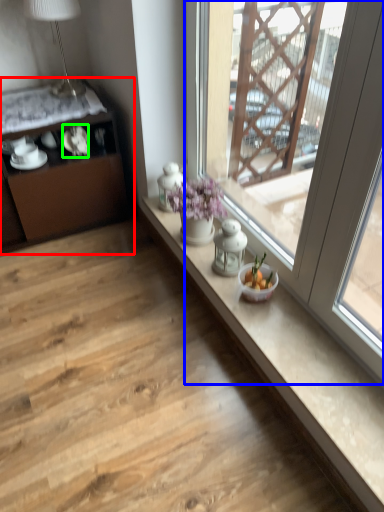
Question: Based on their relative distances, which object is nearer to cabinetry (highlighted by a red box)? Choose from window (highlighted by a blue box) and tableware (highlighted by a green box).

Choices:
 (A) window
 (B) tableware

Answer: (B)